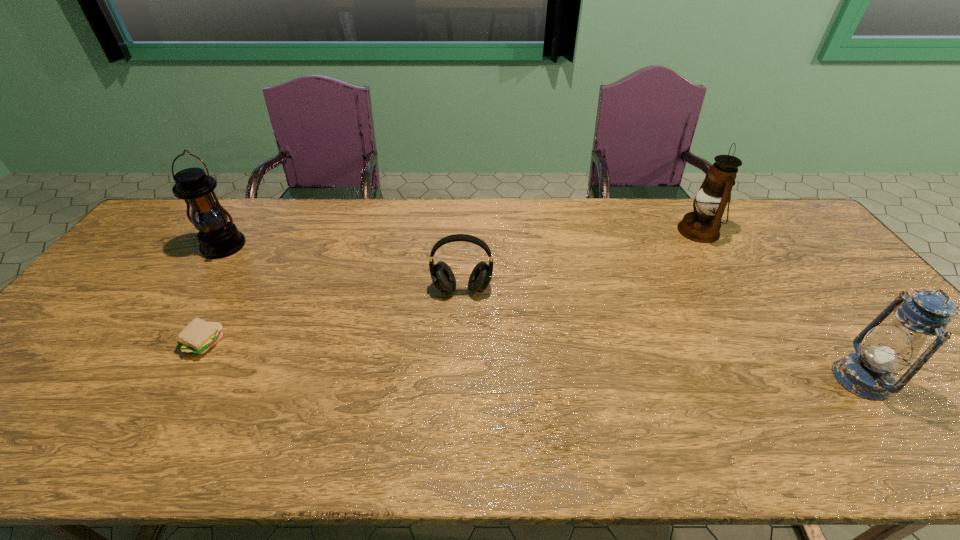
The height and width of the screenshot is (540, 960). I want to click on the leftmost lantern, so click(218, 238).

The height and width of the screenshot is (540, 960). Find the location of `the fourth object from left to right`. the fourth object from left to right is located at coordinates (703, 225).

The image size is (960, 540). In order to click on the nearest lantern in this screenshot , I will do `click(868, 373)`.

The width and height of the screenshot is (960, 540). I want to click on the rightmost lantern, so click(868, 373).

Where is `headset`? Image resolution: width=960 pixels, height=540 pixels. headset is located at coordinates (442, 276).

You are a GUI agent. You are given a task and a screenshot of the screen. Output one action in this format:
    pyautogui.click(x=<x>, y=<y>)
    Task: Click on the third object from right to left
    This screenshot has height=540, width=960.
    Given the screenshot: What is the action you would take?
    pyautogui.click(x=442, y=276)

Image resolution: width=960 pixels, height=540 pixels. I want to click on patty, so click(x=198, y=336).

Identify a few spots in free region located 0.240m above the leftmost lantern, indicating its light source. Please provide its 2D coordinates. Your answer should be formatted as a tuple, i.e. [(x, y)], where the tuple contains the x and y coordinates of a point satisfying the conditions above.

[(173, 321)]

Identify the location of vacant region located 0.340m on the side of the second lantern from left to right, there is a wick adjustment knob. This screenshot has width=960, height=540. (576, 231).

You are a GUI agent. You are given a task and a screenshot of the screen. Output one action in this format:
    pyautogui.click(x=<x>, y=<y>)
    Task: Click on the free space located 0.320m on the side of the second lantern from left to right, there is a wick adjustment knob
    This screenshot has height=540, width=960.
    Given the screenshot: What is the action you would take?
    pyautogui.click(x=582, y=231)